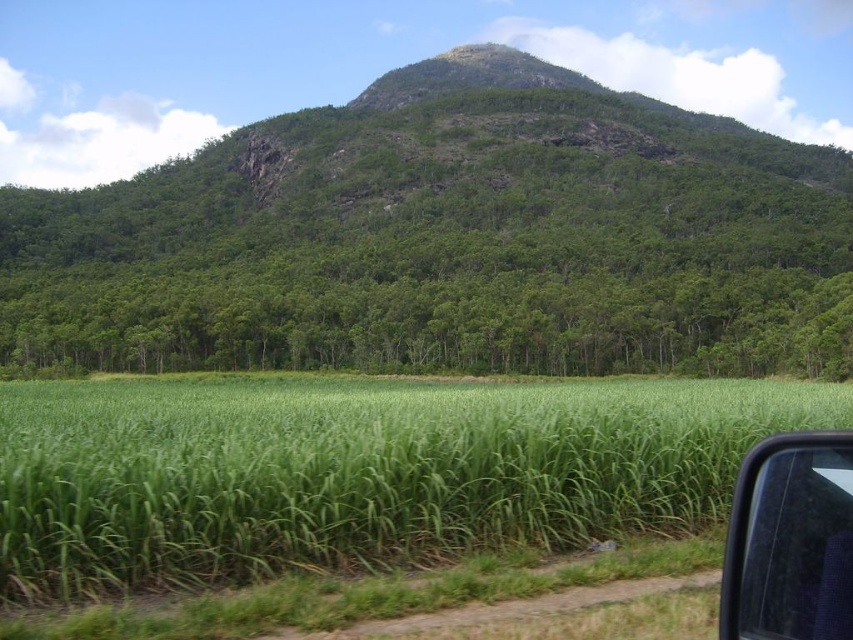
Can you confirm if green leafy forest at upper center is positioned to the right of green grassy field at center?

In fact, green leafy forest at upper center is to the left of green grassy field at center.

Does green leafy forest at upper center have a larger size compared to green grassy field at center?

Correct, green leafy forest at upper center is larger in size than green grassy field at center.

Describe the element at coordinates (447, 240) in the screenshot. I see `green leafy forest at upper center` at that location.

At what (x,y) coordinates should I click in order to perform the action: click on green leafy forest at upper center. Please return your answer as a coordinate pair (x, y). Image resolution: width=853 pixels, height=640 pixels. Looking at the image, I should click on (447, 240).

Does green grassy field at center appear over transparent glass car window at lower right?

Incorrect, green grassy field at center is not positioned above transparent glass car window at lower right.

Can you confirm if green grassy field at center is taller than transparent glass car window at lower right?

Indeed, green grassy field at center has a greater height compared to transparent glass car window at lower right.

Where is `green grassy field at center`? green grassy field at center is located at coordinates (358, 472).

Which is behind, point (811, 284) or point (831, 500)?

Point (811, 284)

Who is positioned more to the right, green leafy forest at upper center or transparent glass car window at lower right?

transparent glass car window at lower right is more to the right.

Locate an element on the screen. The height and width of the screenshot is (640, 853). green leafy forest at upper center is located at coordinates pos(447,240).

Where is `green leafy forest at upper center`? This screenshot has height=640, width=853. green leafy forest at upper center is located at coordinates (447, 240).